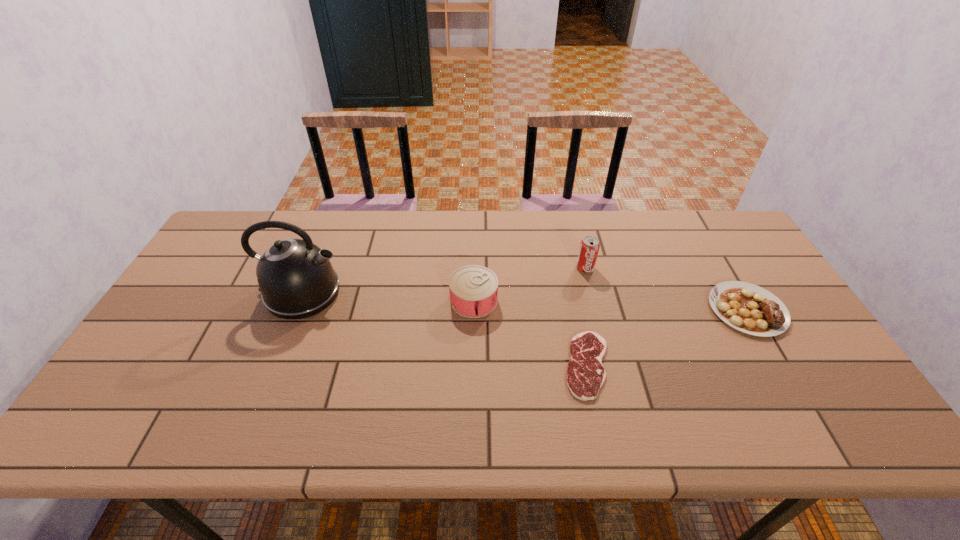
Where is `vacant space located 0.050m on the right of the soda can`? The image size is (960, 540). vacant space located 0.050m on the right of the soda can is located at coordinates (611, 268).

Identify the location of vacant space located 0.340m on the back of the fourth object from right to left. This screenshot has width=960, height=540. (475, 216).

The image size is (960, 540). I want to click on vacant position located on the left of the taller steak, so click(636, 309).

Where is `vacant space located on the back of the left steak`? vacant space located on the back of the left steak is located at coordinates (565, 259).

Where is `object that is positioned at the right edge`? object that is positioned at the right edge is located at coordinates (751, 309).

Identify the location of free space at the far edge of the desktop. The width and height of the screenshot is (960, 540). (490, 236).

Find the location of a particular element. The height and width of the screenshot is (540, 960). vacant space at the near edge is located at coordinates (213, 441).

This screenshot has height=540, width=960. In the image, there is a desktop. In order to click on free region at the left edge in this screenshot , I will do `click(206, 263)`.

The width and height of the screenshot is (960, 540). Find the location of `free region at the right edge of the desktop`. free region at the right edge of the desktop is located at coordinates (829, 396).

Locate an element on the screen. The image size is (960, 540). vacant space at the far left corner of the desktop is located at coordinates (251, 237).